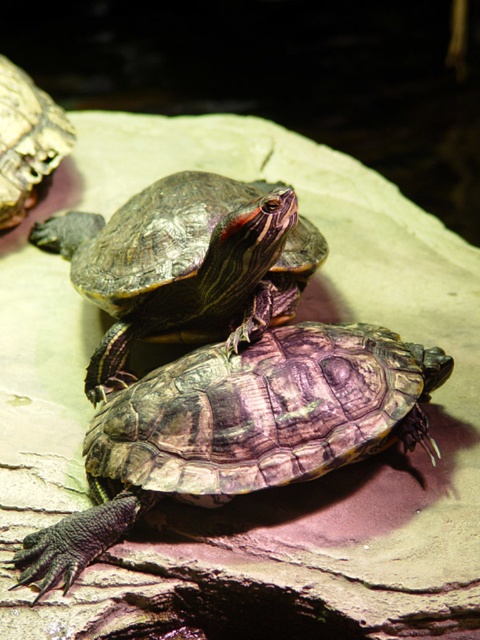
Question: Which point is farther to the camera?

Choices:
 (A) (271, 307)
 (B) (220, 493)

Answer: (A)

Question: Does textured brown tortoise at center appear under shiny brown tortoise at upper left?

Choices:
 (A) yes
 (B) no

Answer: (A)

Question: Which point is closer to the camera?

Choices:
 (A) (13, 70)
 (B) (85, 248)

Answer: (B)

Question: Is textured brown tortoise at center bigger than shiny brown tortoise at center?

Choices:
 (A) yes
 (B) no

Answer: (B)

Question: Observing the image, what is the correct spatial positioning of textured brown tortoise at center in reference to shiny brown tortoise at upper left?

Choices:
 (A) above
 (B) below

Answer: (B)

Question: Which object is closer to the camera taking this photo?

Choices:
 (A) textured brown tortoise at center
 (B) shiny brown tortoise at center

Answer: (A)